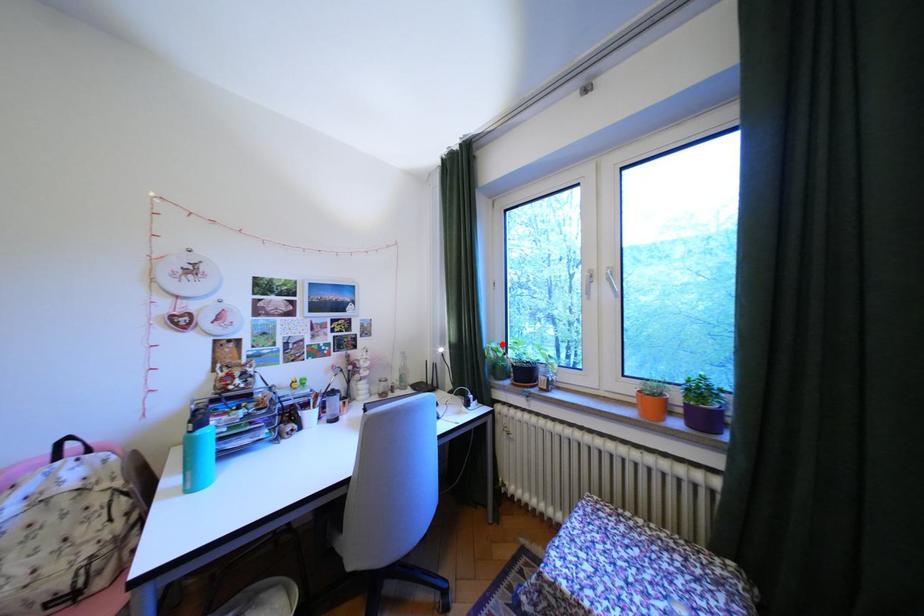
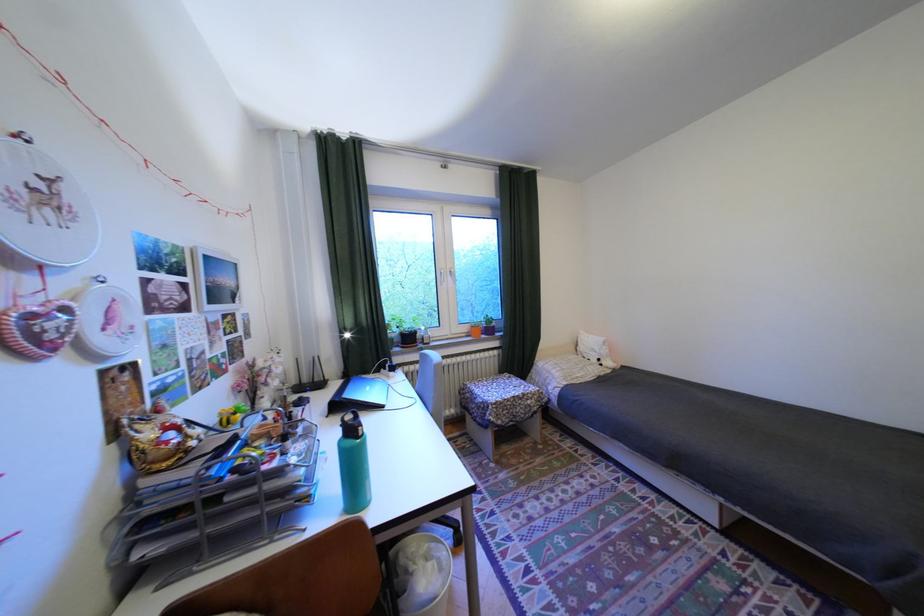
Question: I am providing you with two images of the same scene from different viewpoints. A red point is marked on the first image. Can you still see the location of the red point in image 2?

Choices:
 (A) Yes
 (B) No

Answer: (A)